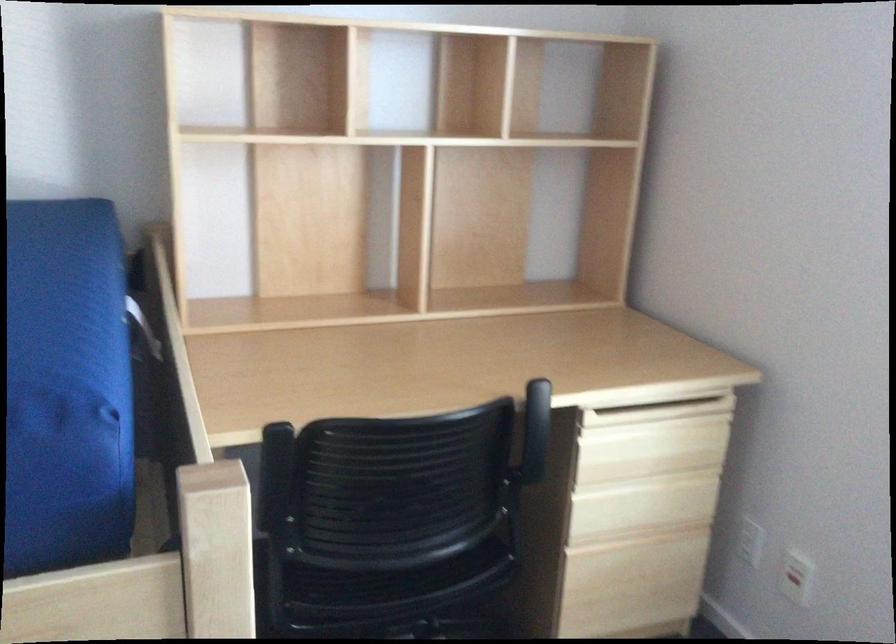
The height and width of the screenshot is (644, 896). What do you see at coordinates (397, 585) in the screenshot?
I see `a black chair sitting surface` at bounding box center [397, 585].